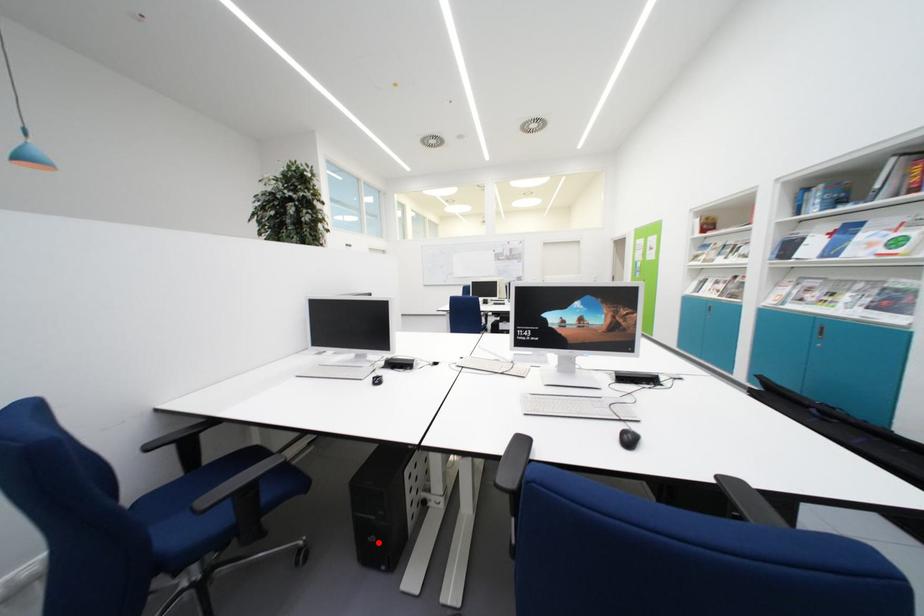
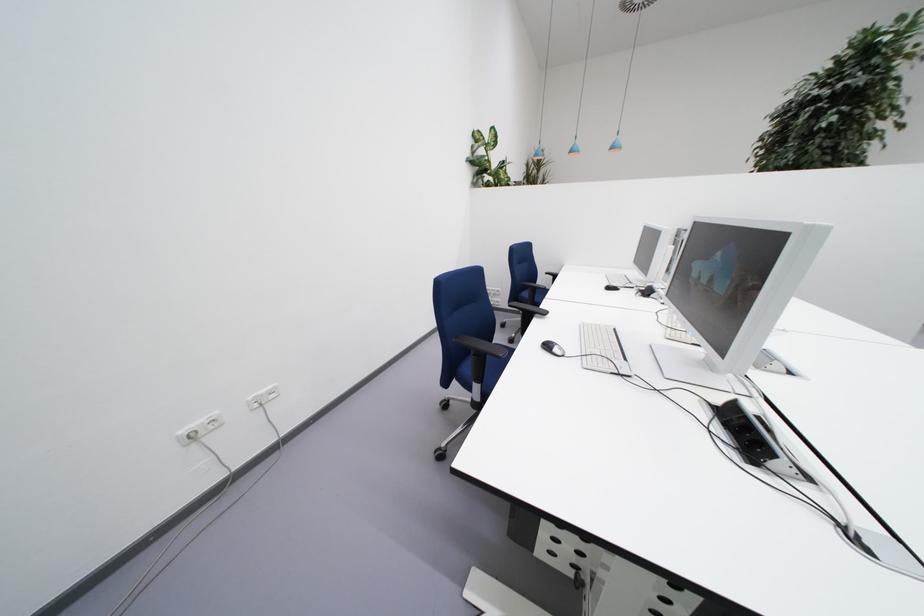
Question: I am providing you with two images of the same scene from different viewpoints. A red point is marked on the first image. Can you still see the location of the red point in image 2?

Choices:
 (A) Yes
 (B) No

Answer: (B)